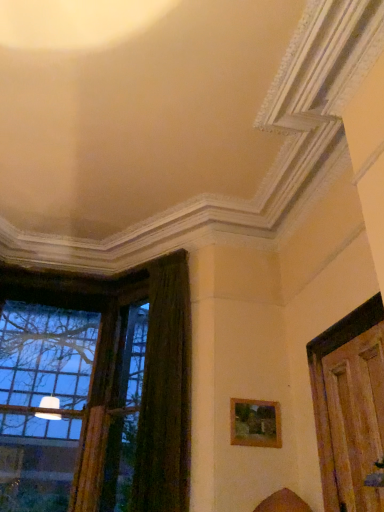
Question: From the image's perspective, is wooden picture frame at lower right beneath dark green velvet curtain at left?

Choices:
 (A) no
 (B) yes

Answer: (B)

Question: Considering the relative positions of wooden picture frame at lower right and dark green velvet curtain at left in the image provided, is wooden picture frame at lower right to the right of dark green velvet curtain at left from the viewer's perspective?

Choices:
 (A) yes
 (B) no

Answer: (A)

Question: Is wooden picture frame at lower right closer to the viewer compared to dark green velvet curtain at left?

Choices:
 (A) yes
 (B) no

Answer: (B)

Question: Does wooden picture frame at lower right have a lesser width compared to dark green velvet curtain at left?

Choices:
 (A) yes
 (B) no

Answer: (A)

Question: Is wooden picture frame at lower right outside dark green velvet curtain at left?

Choices:
 (A) yes
 (B) no

Answer: (A)

Question: In terms of width, does clear glass window at left look wider or thinner when compared to wooden picture frame at lower right?

Choices:
 (A) wide
 (B) thin

Answer: (A)

Question: From a real-world perspective, is clear glass window at left physically located above or below wooden picture frame at lower right?

Choices:
 (A) above
 (B) below

Answer: (A)

Question: Is clear glass window at left in front of or behind wooden picture frame at lower right in the image?

Choices:
 (A) front
 (B) behind

Answer: (B)

Question: Is point (150, 509) closer or farther from the camera than point (231, 404)?

Choices:
 (A) farther
 (B) closer

Answer: (B)

Question: From the image's perspective, is clear glass window at left above or below dark green velvet curtain at left?

Choices:
 (A) below
 (B) above

Answer: (A)

Question: From a real-world perspective, is clear glass window at left positioned above or below dark green velvet curtain at left?

Choices:
 (A) below
 (B) above

Answer: (B)

Question: Looking at the image, does clear glass window at left seem bigger or smaller compared to dark green velvet curtain at left?

Choices:
 (A) big
 (B) small

Answer: (A)

Question: Is clear glass window at left wider or thinner than dark green velvet curtain at left?

Choices:
 (A) thin
 (B) wide

Answer: (B)

Question: From their relative heights in the image, would you say clear glass window at left is taller or shorter than wooden door at right?

Choices:
 (A) short
 (B) tall

Answer: (B)

Question: Is point 43,473 closer or farther from the camera than point 342,418?

Choices:
 (A) closer
 (B) farther

Answer: (B)